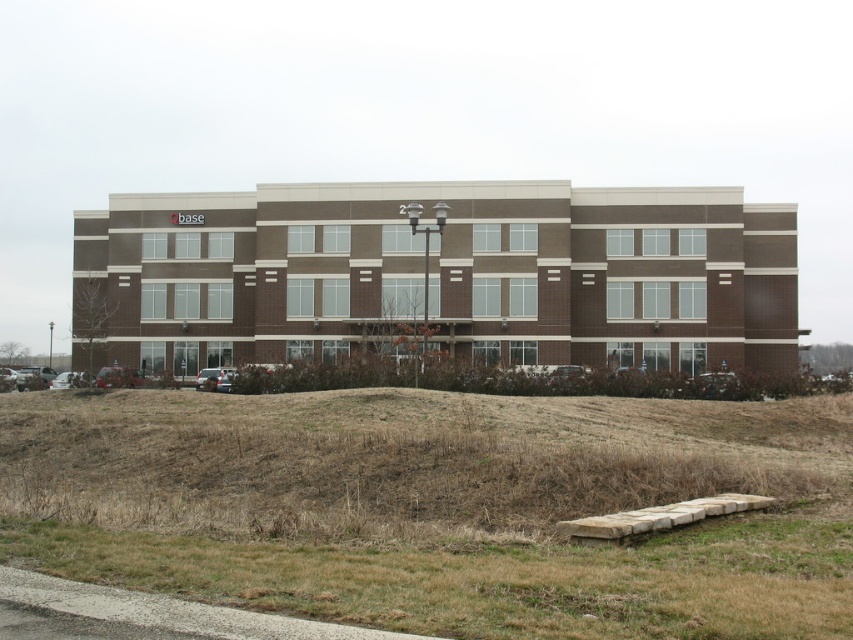
Question: Is brown dry grass at lower center behind dry grass at lower center?

Choices:
 (A) yes
 (B) no

Answer: (B)

Question: Is brown dry grass at lower center above dry grass at lower center?

Choices:
 (A) yes
 (B) no

Answer: (B)

Question: Which point is closer to the camera taking this photo?

Choices:
 (A) coord(596,476)
 (B) coord(769,531)

Answer: (B)

Question: Which point is closer to the camera?

Choices:
 (A) dry grass at lower center
 (B) brown dry grass at lower center

Answer: (B)

Question: Does brown dry grass at lower center come behind dry grass at lower center?

Choices:
 (A) no
 (B) yes

Answer: (A)